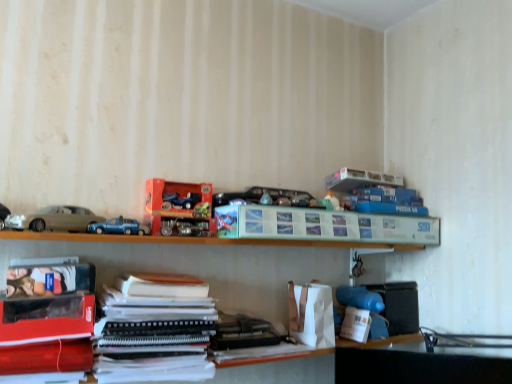
Question: Is white matte toy at lower right, the first toy in the bottom-to-top sequence, completely or partially outside of matte paper paperback book at center, which is the 2th paperback book from left to right?

Choices:
 (A) yes
 (B) no

Answer: (A)

Question: Can you confirm if white matte toy at lower right, placed as the second toy when sorted from right to left, is wider than matte paper paperback book at center, which ranks as the second paperback book in bottom-to-top order?

Choices:
 (A) no
 (B) yes

Answer: (B)

Question: Considering the relative positions of white matte toy at lower right, the first toy in the bottom-to-top sequence, and matte paper paperback book at center, which is the 2th paperback book from left to right, in the image provided, is white matte toy at lower right, the first toy in the bottom-to-top sequence, in front of matte paper paperback book at center, which is the 2th paperback book from left to right,?

Choices:
 (A) yes
 (B) no

Answer: (B)

Question: Can you confirm if white matte toy at lower right, placed as the fourth toy when sorted from left to right, is positioned to the left of matte paper paperback book at center, the 1th paperback book from the back?

Choices:
 (A) yes
 (B) no

Answer: (B)

Question: Can you confirm if white matte toy at lower right, placed as the fourth toy when sorted from left to right, is positioned to the right of matte paper paperback book at center, which ranks as the second paperback book in bottom-to-top order?

Choices:
 (A) yes
 (B) no

Answer: (A)

Question: Considering the positions of blue matte toy car at center and matte black paperback book at lower left, acting as the 2th paperback book starting from the back, in the image, is blue matte toy car at center wider or thinner than matte black paperback book at lower left, acting as the 2th paperback book starting from the back,?

Choices:
 (A) wide
 (B) thin

Answer: (B)

Question: Is blue matte toy car at center bigger or smaller than matte black paperback book at lower left, arranged as the 2th paperback book when viewed from the top?

Choices:
 (A) big
 (B) small

Answer: (B)

Question: Considering their positions, is blue matte toy car at center located in front of or behind matte black paperback book at lower left, acting as the 2th paperback book starting from the back?

Choices:
 (A) front
 (B) behind

Answer: (B)

Question: Which is correct: blue matte toy car at center is inside matte black paperback book at lower left, which ranks as the 1th paperback book in front-to-back order, or outside of it?

Choices:
 (A) inside
 (B) outside

Answer: (B)

Question: Does point (248, 190) appear closer or farther from the camera than point (83, 281)?

Choices:
 (A) closer
 (B) farther

Answer: (B)

Question: Would you say metallic car at center, arranged as the second toy when viewed from the top, is to the left or to the right of matte plastic book at lower left, the 1th book viewed from the front, in the picture?

Choices:
 (A) left
 (B) right

Answer: (B)

Question: From a real-world perspective, is metallic car at center, which is the fourth toy in bottom-to-top order, above or below matte plastic book at lower left, which is the second book in back-to-front order?

Choices:
 (A) above
 (B) below

Answer: (A)

Question: From their relative heights in the image, would you say metallic car at center, the fifth toy viewed from the right, is taller or shorter than matte plastic book at lower left, which is the 2th book from right to left?

Choices:
 (A) tall
 (B) short

Answer: (A)

Question: Considering the positions of wooden shelf at lower center, which is the 2th shelf in top-to-bottom order, and blue matte toy car at center in the image, is wooden shelf at lower center, which is the 2th shelf in top-to-bottom order, wider or thinner than blue matte toy car at center?

Choices:
 (A) wide
 (B) thin

Answer: (A)

Question: From a real-world perspective, is wooden shelf at lower center, placed as the 2th shelf when sorted from left to right, above or below blue matte toy car at center?

Choices:
 (A) above
 (B) below

Answer: (B)